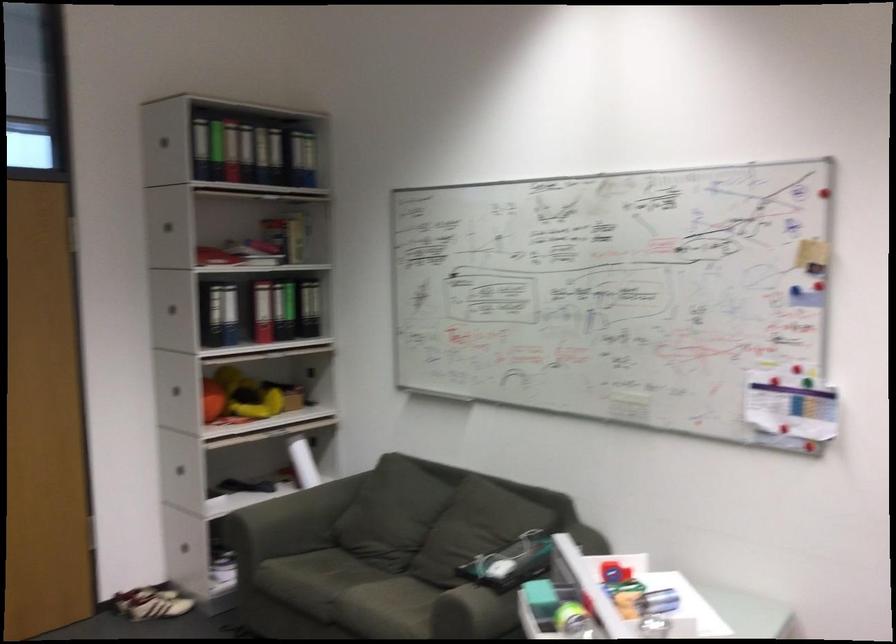
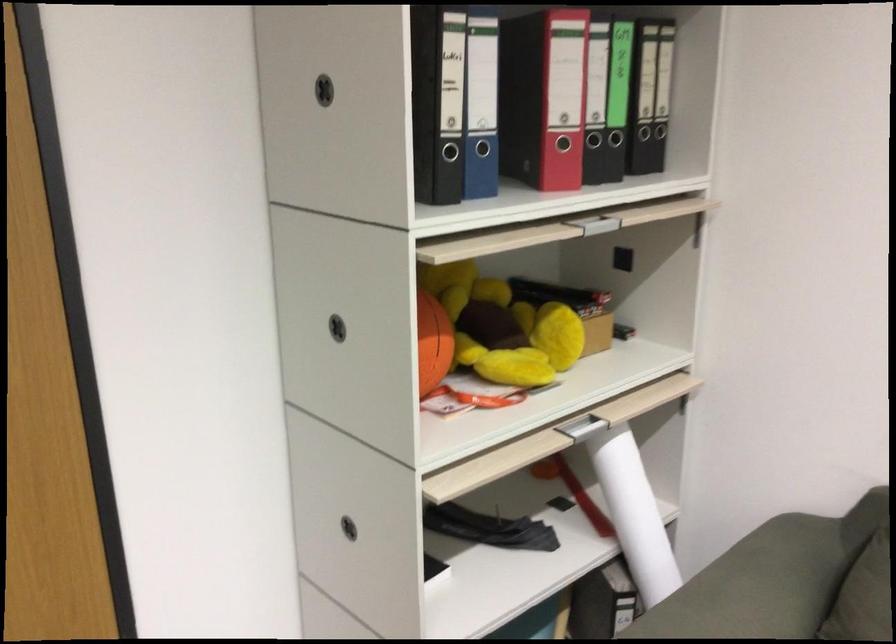
Locate, in the second image, the point that corresponds to (209,406) in the first image.

(433, 343)